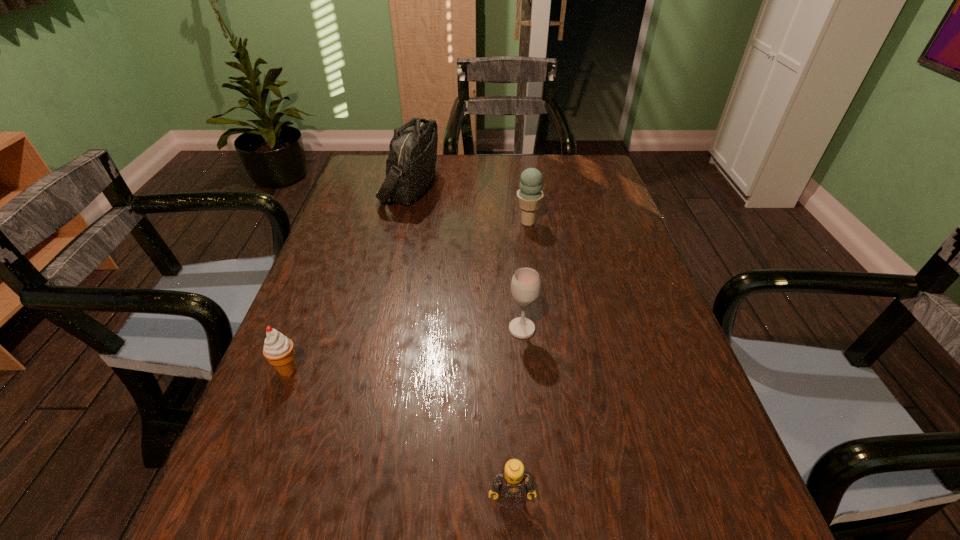
I want to click on vacant position in the image that satisfies the following two spatial constraints: 1. at the front padded panel of the farthest object; 2. on the left side of the farther icecream, so click(x=402, y=222).

Locate an element on the screen. This screenshot has width=960, height=540. free spot that satisfies the following two spatial constraints: 1. on the back side of the farther icecream; 2. on the right side of the wineglass is located at coordinates (512, 222).

This screenshot has width=960, height=540. What are the coordinates of `vacant area in the image that satisfies the following two spatial constraints: 1. at the front padded panel of the fourth object from right to left; 2. on the back side of the taller icecream` in the screenshot? It's located at (402, 222).